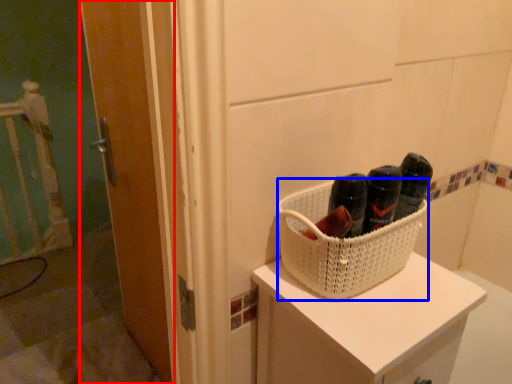
Question: Which of the following is the closest to the observer, door (highlighted by a red box) or basket (highlighted by a blue box)?

Choices:
 (A) door
 (B) basket

Answer: (B)